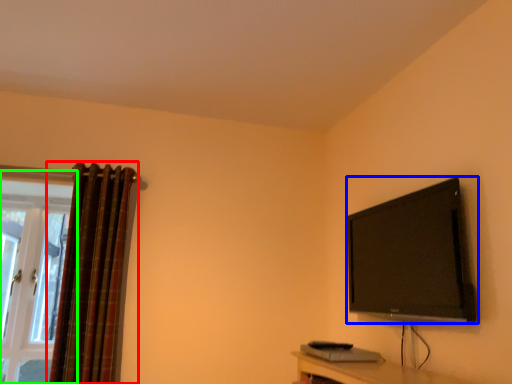
Question: Which object is the closest to the curtain (highlighted by a red box)? Choose among these: television (highlighted by a blue box) or window (highlighted by a green box).

Choices:
 (A) television
 (B) window

Answer: (B)